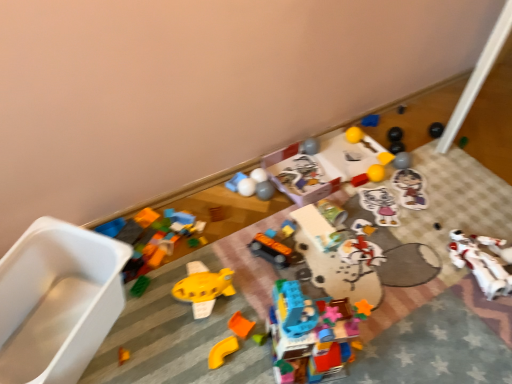
Identify the location of free point to the right of matte plastic sticker at center, which is the second toy in right-to-left order. (452, 195).